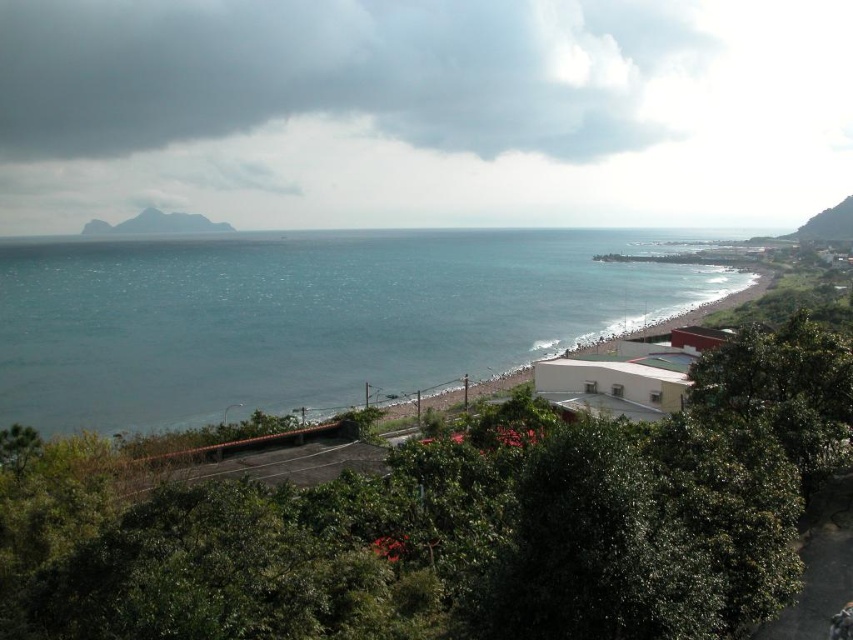
You are a hiker who wants to take a photo of both the gray rocky mountain at upper left and the green leafy hillside at upper right. Based on their positions, which one should you frame first in your camera viewfinder to ensure both are visible in the same shot?

The gray rocky mountain at upper left is positioned on the left side of the green leafy hillside at upper right, so you should frame the gray rocky mountain at upper left first to ensure both are visible in the same shot.

You are standing on the pebble beach looking towards the mountainous landmass. There are two points marked on the image. Which of the two points, point (256, 253) or point (108, 230), is closer to you?

Point (256, 253) is closer to the viewer than point (108, 230).